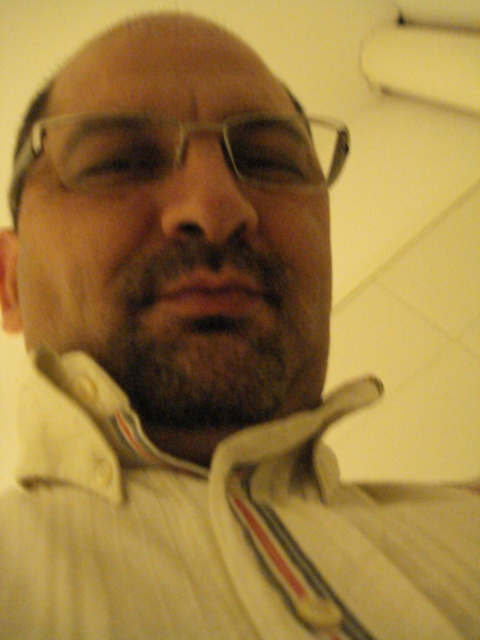
Can you confirm if white ribbed fabric at center is bigger than clear plastic glasses at center?

Incorrect, white ribbed fabric at center is not larger than clear plastic glasses at center.

Can you confirm if white ribbed fabric at center is positioned to the right of clear plastic glasses at center?

Indeed, white ribbed fabric at center is positioned on the right side of clear plastic glasses at center.

Describe the element at coordinates (220, 529) in the screenshot. The width and height of the screenshot is (480, 640). I see `white ribbed fabric at center` at that location.

What are the coordinates of `white ribbed fabric at center` in the screenshot? It's located at (220, 529).